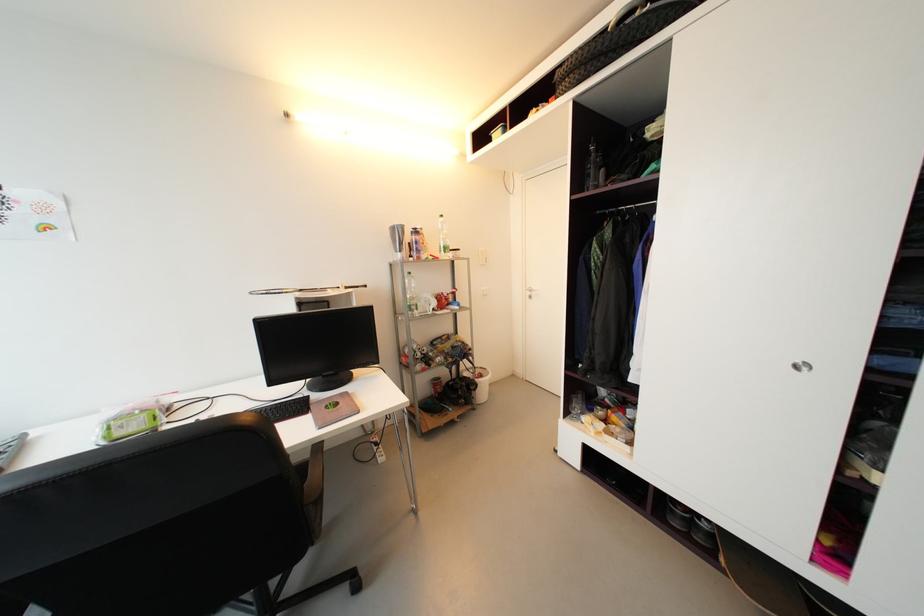
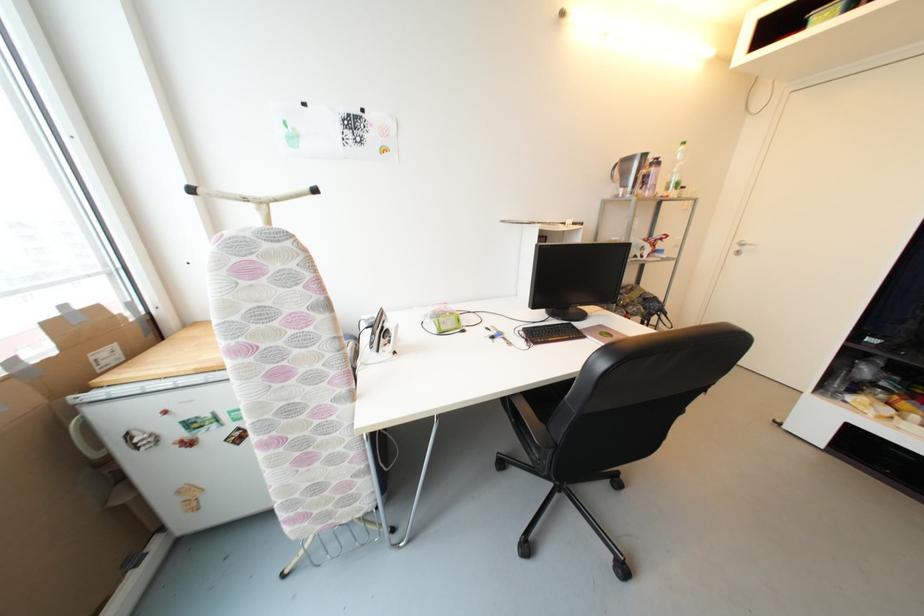
Question: Which direction would the cameraman need to move to produce the second image? Reply with the corresponding letter.

Choices:
 (A) Left
 (B) Right
 (C) Forward
 (D) Backward

Answer: (A)